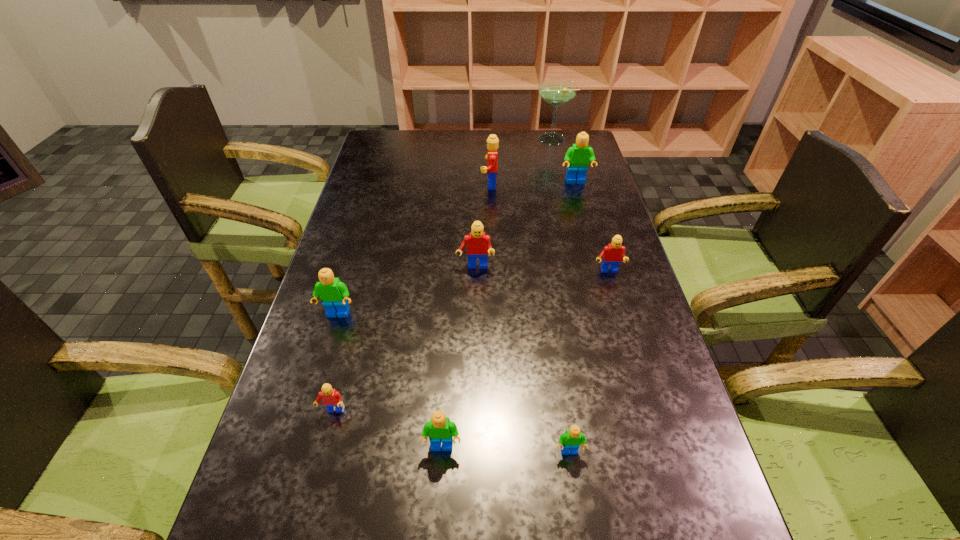
This screenshot has width=960, height=540. In order to click on green martini in this screenshot , I will do `click(556, 92)`.

I want to click on martini, so click(556, 92).

At what (x,y) coordinates should I click in order to perform the action: click on the biggest red Lego. Please return your answer as a coordinate pair (x, y). The image size is (960, 540). Looking at the image, I should click on (492, 145).

Where is `the rightmost green Lego`? The image size is (960, 540). the rightmost green Lego is located at coordinates (577, 158).

You are a GUI agent. You are given a task and a screenshot of the screen. Output one action in this format:
    pyautogui.click(x=<x>, y=<y>)
    Task: Click on the farthest green Lego
    Image resolution: width=960 pixels, height=540 pixels.
    Given the screenshot: What is the action you would take?
    pyautogui.click(x=577, y=158)

The height and width of the screenshot is (540, 960). Identify the location of the second farthest green Lego. (334, 294).

This screenshot has height=540, width=960. I want to click on the leftmost green Lego, so click(334, 294).

Where is `the second biggest red Lego`? the second biggest red Lego is located at coordinates (478, 243).

The height and width of the screenshot is (540, 960). In order to click on the rightmost red Lego in this screenshot , I will do `click(612, 254)`.

Locate an element on the screen. The height and width of the screenshot is (540, 960). the second green Lego from left to right is located at coordinates (440, 429).